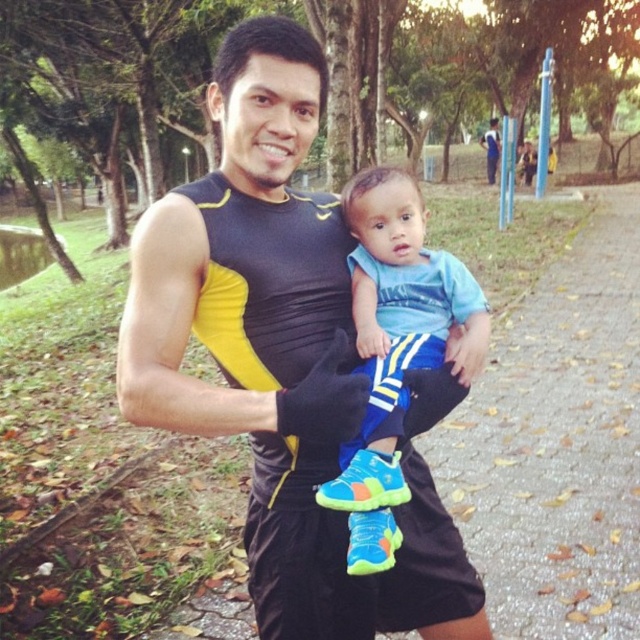
You are standing at the point labeled as point [358,298] in the image. The man and child are facing towards the camera. If you want to approach them without being in their direct line of sight, which direction should you move relative to your current position?

Since the man and child are facing towards the camera, moving to the side away from their line of sight would allow you to approach without being seen. However, the exact direction depends on the spatial arrangement not fully described here. The point is 1.54 meters away from the viewer, but without additional details on their positioning, a precise direction cannot be determined.